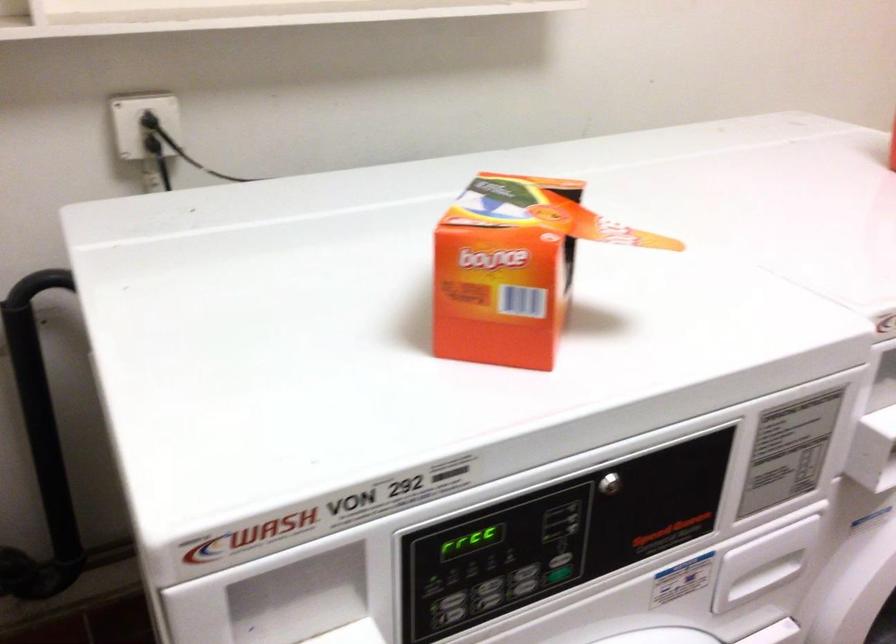
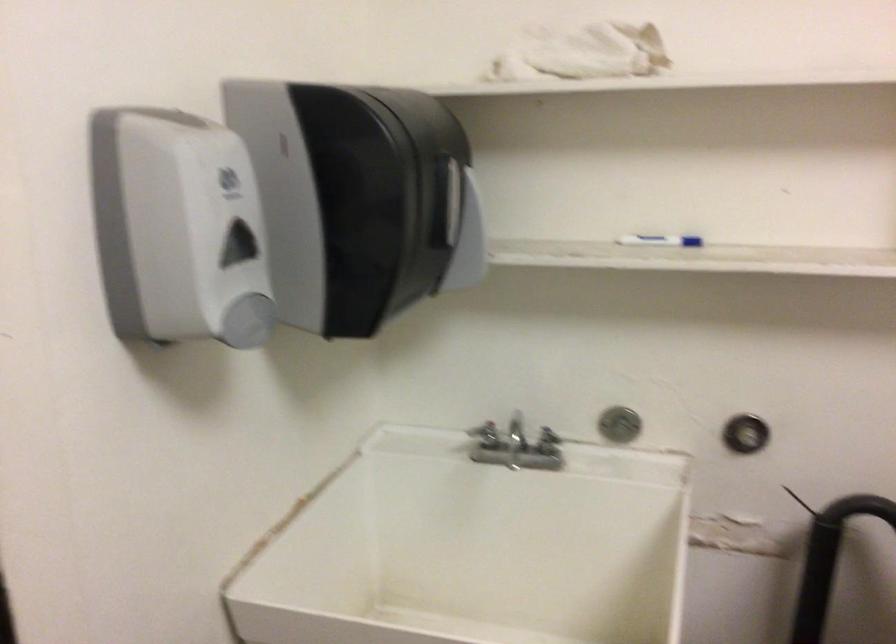
Question: The camera is either moving clockwise (left) or counter-clockwise (right) around the object. The first image is from the beginning of the video and the second image is from the end. Is the camera moving left or right when shooting the video?

Choices:
 (A) Left
 (B) Right

Answer: (B)